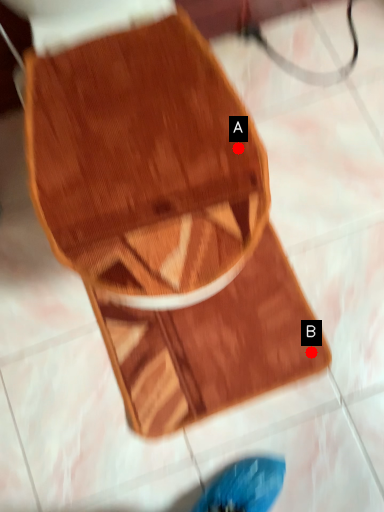
Question: Two points are circled on the image, labeled by A and B beside each circle. Among these points, which one is farthest from the camera?

Choices:
 (A) A is further
 (B) B is further

Answer: (B)